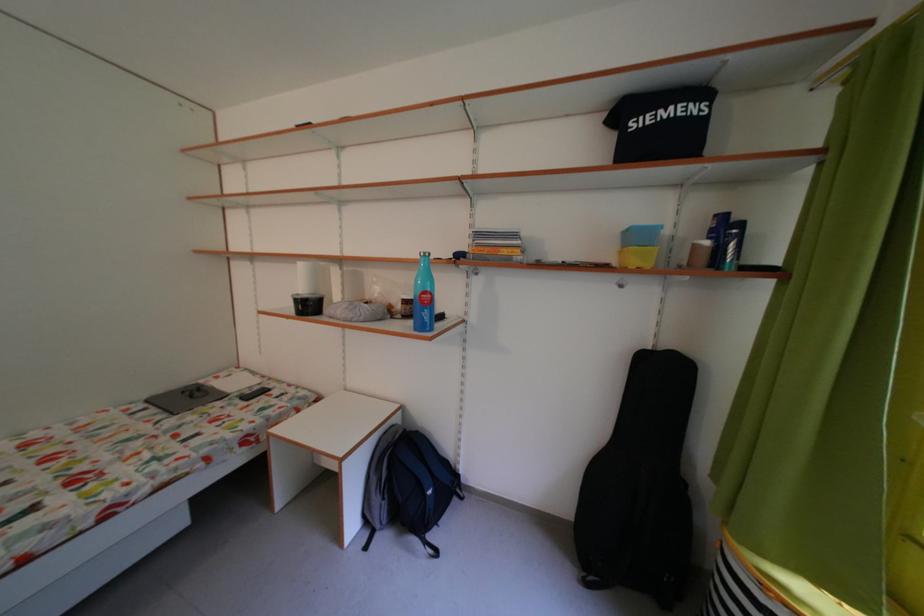
Find where to lift the black plastic container. Please return your answer as a coordinate pair (x, y).

(307, 304)